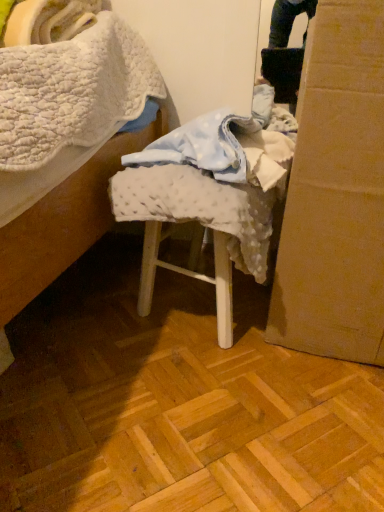
Question: From the image's perspective, is white dotted fabric at center located above or below cardboard box at right?

Choices:
 (A) below
 (B) above

Answer: (A)

Question: In terms of height, does white dotted fabric at center look taller or shorter compared to cardboard box at right?

Choices:
 (A) short
 (B) tall

Answer: (A)

Question: Is point (225, 274) positioned closer to the camera than point (375, 364)?

Choices:
 (A) farther
 (B) closer

Answer: (B)

Question: Is point (372, 283) closer or farther from the camera than point (139, 169)?

Choices:
 (A) farther
 (B) closer

Answer: (B)

Question: From the image's perspective, is cardboard box at right above or below white dotted fabric at center?

Choices:
 (A) above
 (B) below

Answer: (A)

Question: Considering the positions of cardboard box at right and white dotted fabric at center in the image, is cardboard box at right wider or thinner than white dotted fabric at center?

Choices:
 (A) wide
 (B) thin

Answer: (A)

Question: Do you think cardboard box at right is within white dotted fabric at center, or outside of it?

Choices:
 (A) outside
 (B) inside

Answer: (A)